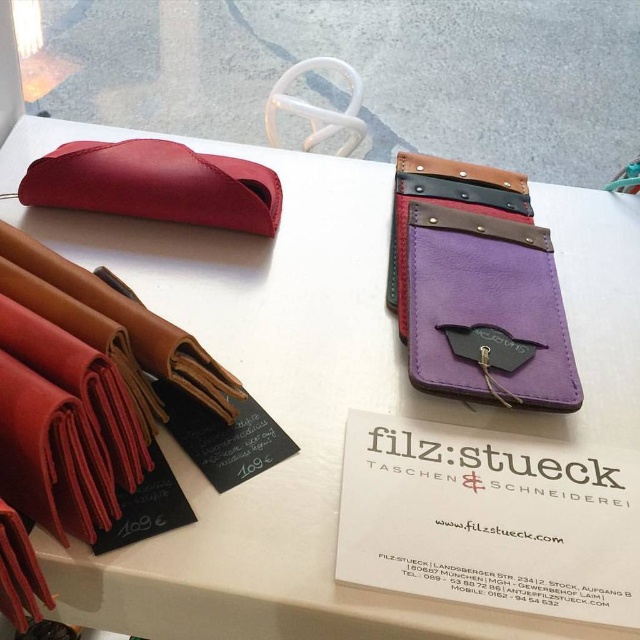
Question: Is purple leather wallet at upper right thinner than matte leather pouch at upper left?

Choices:
 (A) yes
 (B) no

Answer: (A)

Question: Is purple leather wallet at upper right wider than matte leather pouch at upper left?

Choices:
 (A) yes
 (B) no

Answer: (B)

Question: From the image, what is the correct spatial relationship of purple leather wallet at upper right in relation to matte leather pouch at upper left?

Choices:
 (A) right
 (B) left

Answer: (A)

Question: Which point is closer to the camera?

Choices:
 (A) (248, 173)
 (B) (432, 298)

Answer: (B)